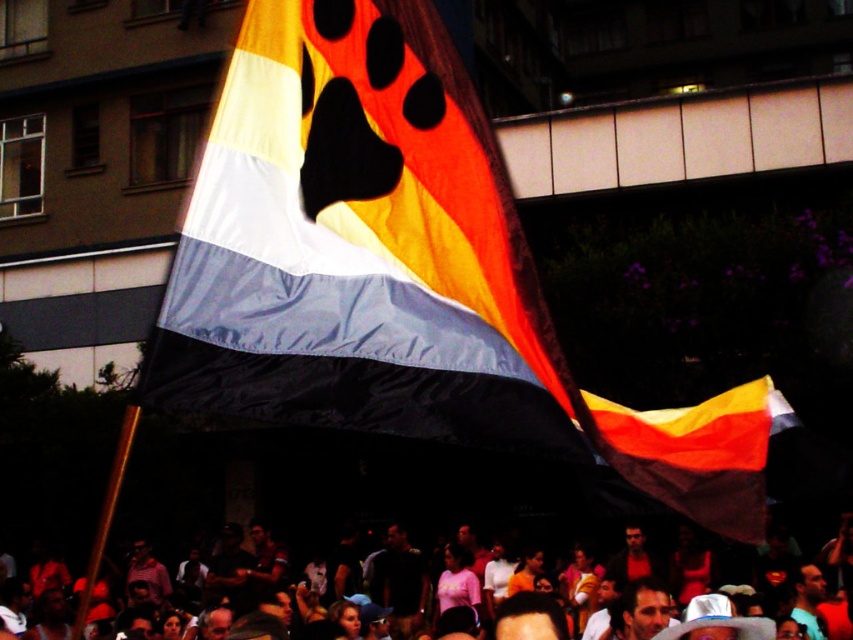
Between silky fabric flag at center and matte orange crowd at lower center, which one has less height?

With less height is matte orange crowd at lower center.

Does silky fabric flag at center appear under matte orange crowd at lower center?

No, silky fabric flag at center is not below matte orange crowd at lower center.

Does point (447, 211) lie behind point (846, 531)?

No, (447, 211) is in front of (846, 531).

In order to click on silky fabric flag at center in this screenshot , I will do `click(398, 269)`.